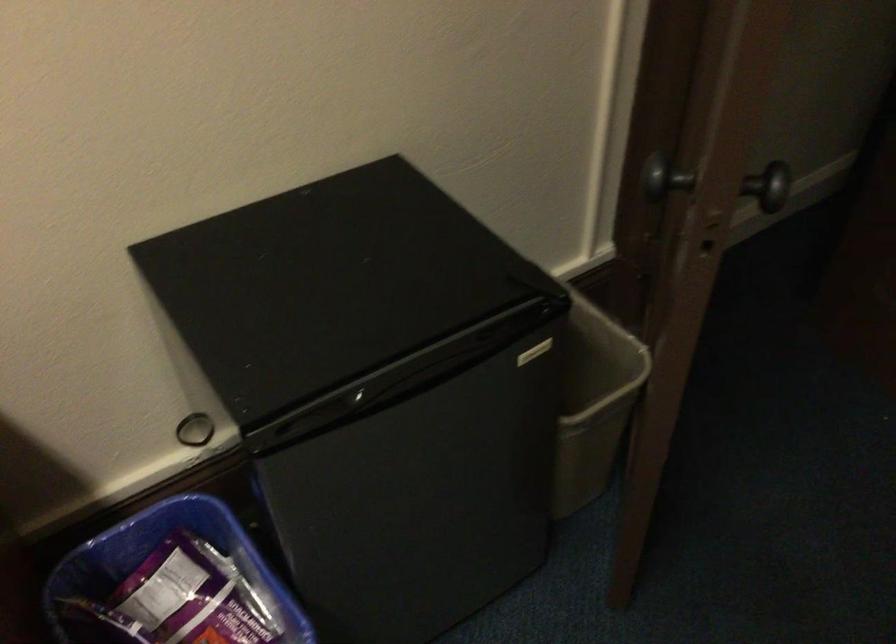
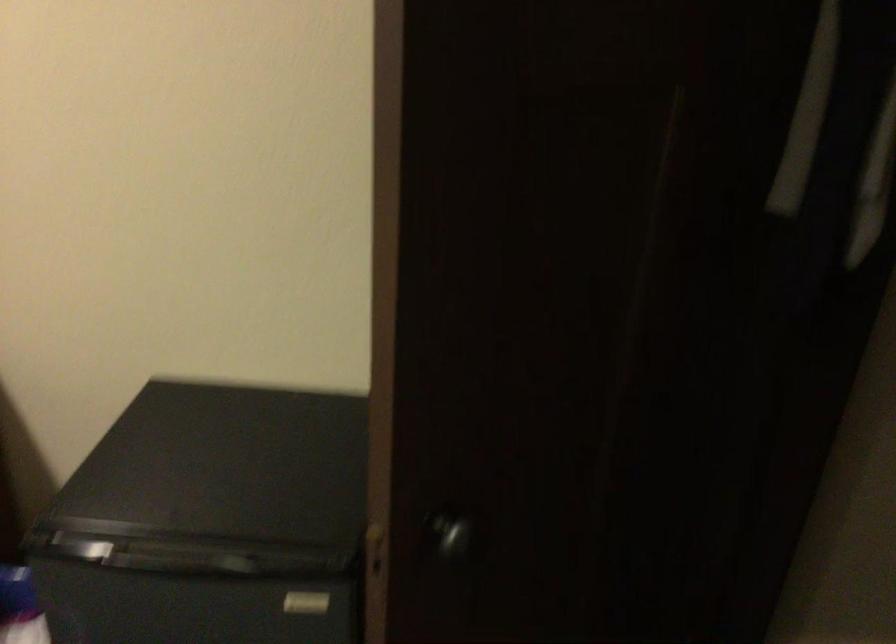
Where in the second image is the point corresponding to [529,359] from the first image?

(306, 603)